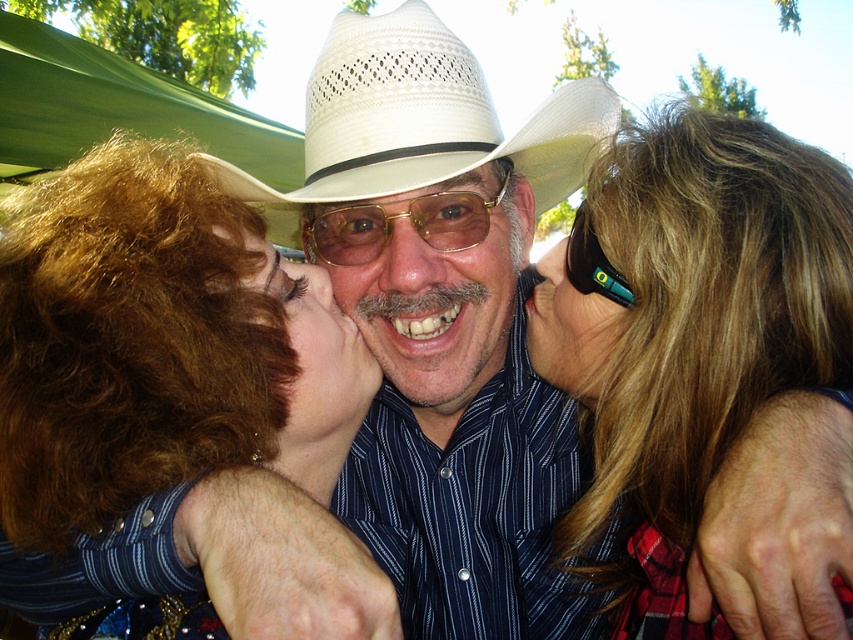
Question: Estimate the real-world distances between objects in this image. Which object is closer to the blonde hair at upper right?

Choices:
 (A) matte skin face at center
 (B) black plastic sunglasses at right
 (C) matte skin nose at center
 (D) curly brown hair at center

Answer: (B)

Question: Does blonde hair at upper right appear over white woven straw cowboy hat at center?

Choices:
 (A) no
 (B) yes

Answer: (A)

Question: Which is nearer to the black plastic sunglasses at right?

Choices:
 (A) matte white cowboy hat at center
 (B) curly brown hair at center

Answer: (A)

Question: Is curly brown hair at center positioned in front of teal plastic goggles at center?

Choices:
 (A) yes
 (B) no

Answer: (A)

Question: Based on their relative distances, which object is nearer to the matte white cowboy hat at center?

Choices:
 (A) curly brown hair at center
 (B) black plastic sunglasses at right

Answer: (B)

Question: Is white woven straw cowboy hat at center wider than matte skin face at center?

Choices:
 (A) no
 (B) yes

Answer: (B)